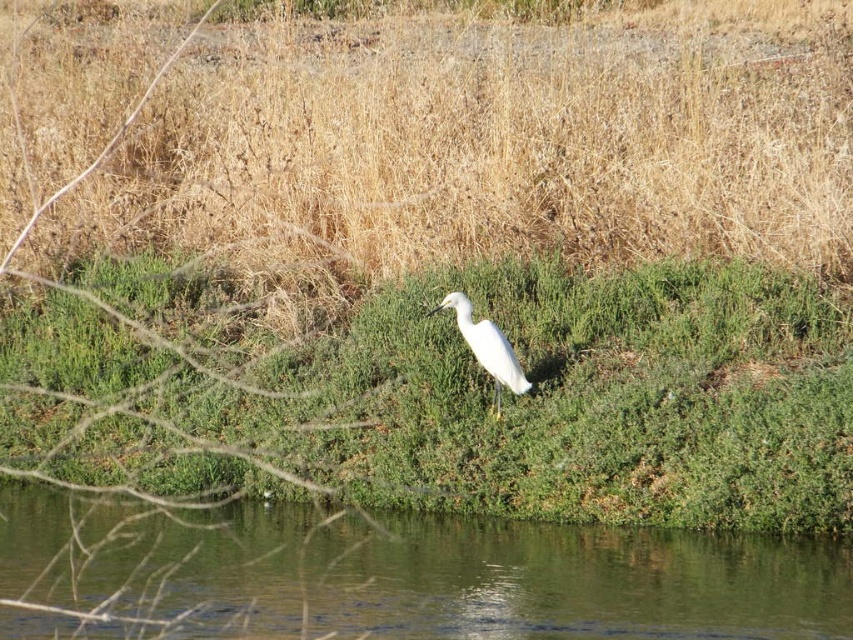
The image size is (853, 640). What do you see at coordinates (476, 579) in the screenshot? I see `green grassy riverbank at center` at bounding box center [476, 579].

Is the position of green grassy riverbank at center less distant than that of white smooth bird at center?

Yes, green grassy riverbank at center is in front of white smooth bird at center.

Does point (199, 568) come behind point (509, 371)?

No, (199, 568) is closer to viewer.

You are a GUI agent. You are given a task and a screenshot of the screen. Output one action in this format:
    pyautogui.click(x=<x>, y=<y>)
    Task: Click on the green grassy riverbank at center
    
    Given the screenshot: What is the action you would take?
    pyautogui.click(x=476, y=579)